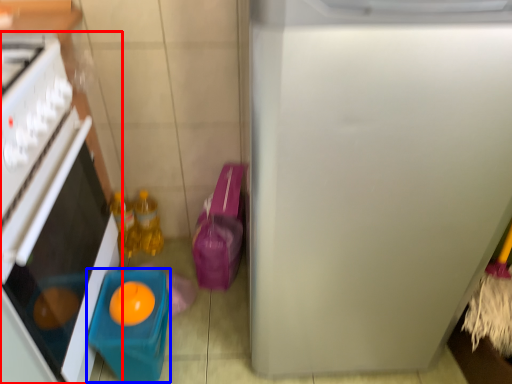
Question: Which of the following is the farthest to the observer, home appliance (highlighted by a red box) or toy (highlighted by a blue box)?

Choices:
 (A) home appliance
 (B) toy

Answer: (B)